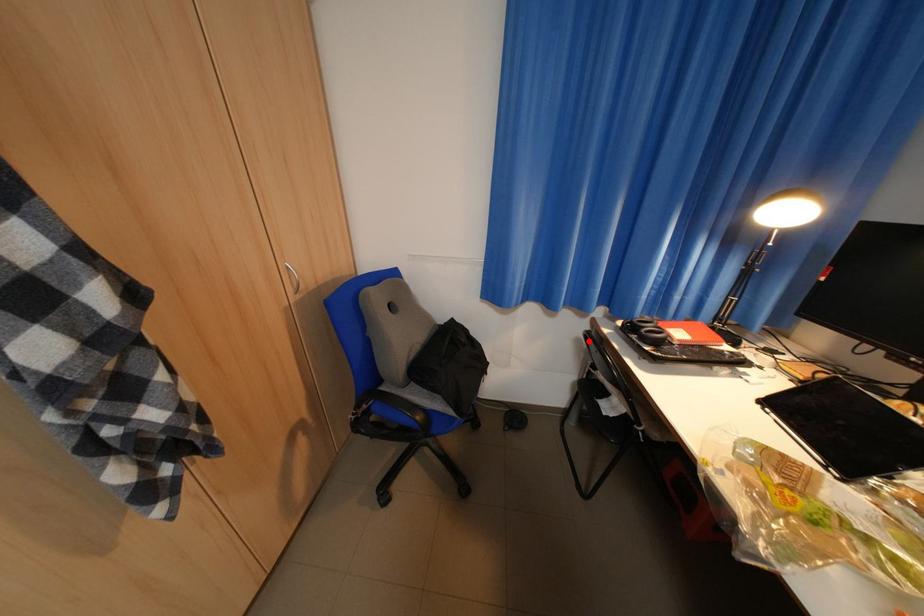
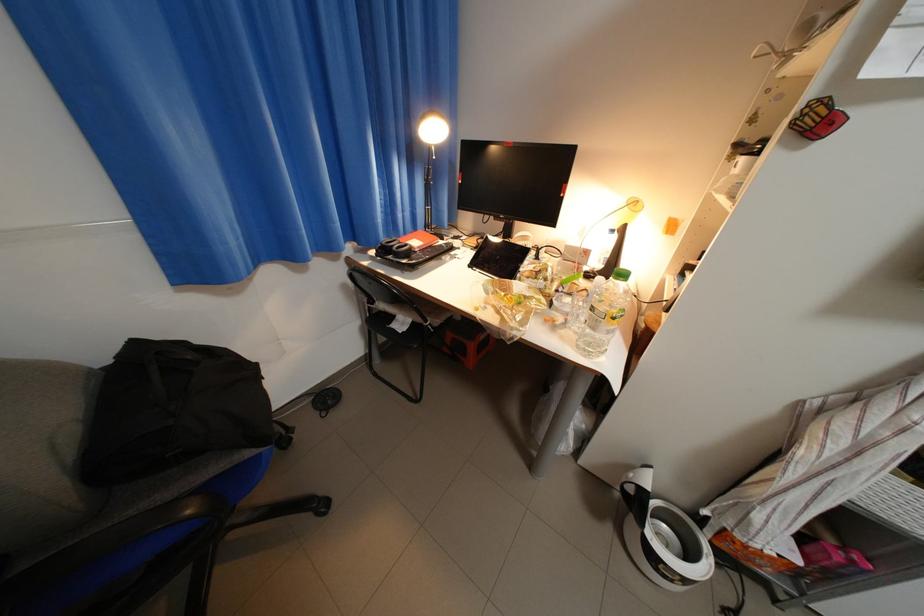
Find the pixel in the second image that matches the highlighted location in the first image.

(355, 286)